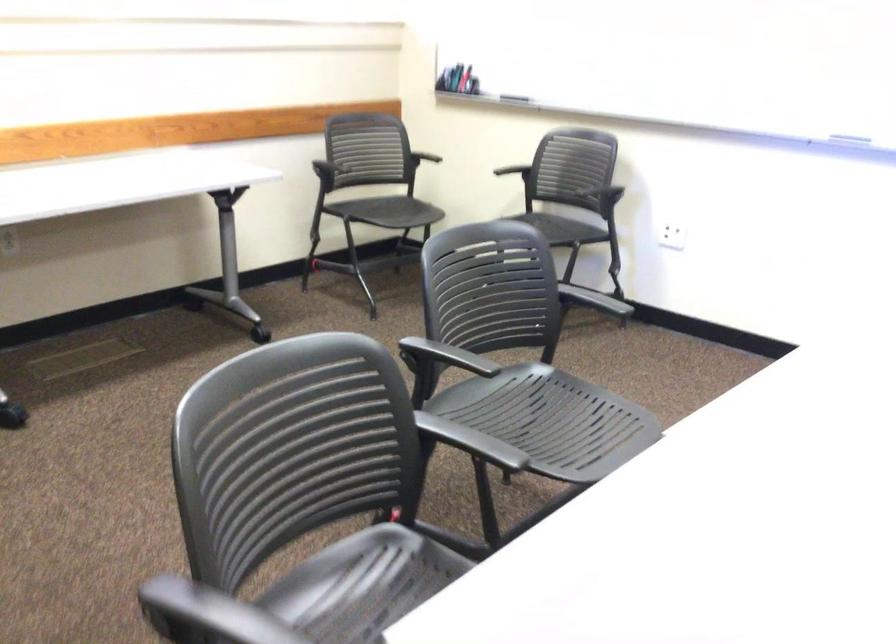
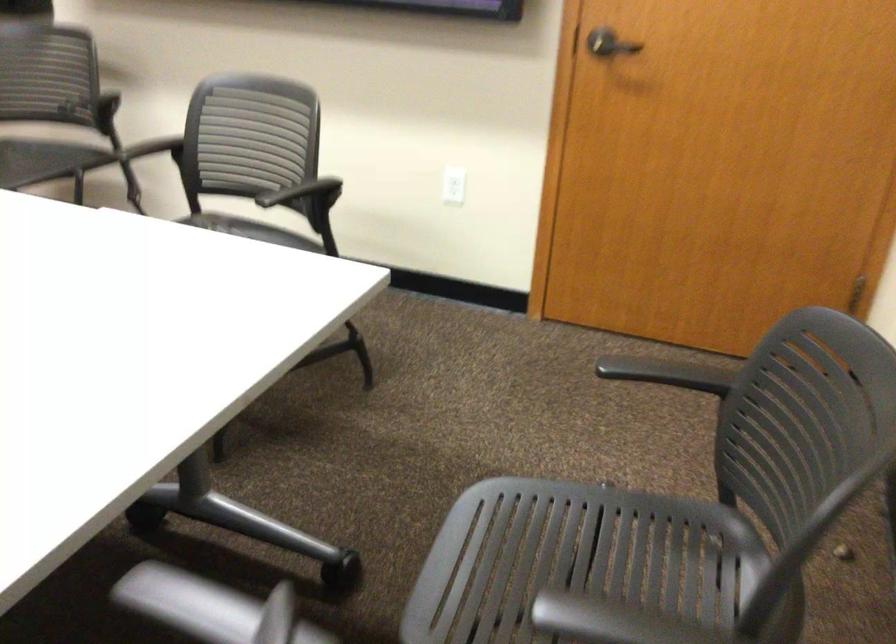
Based on the continuous images, in which direction is the camera rotating?

The camera rotated toward right-down.